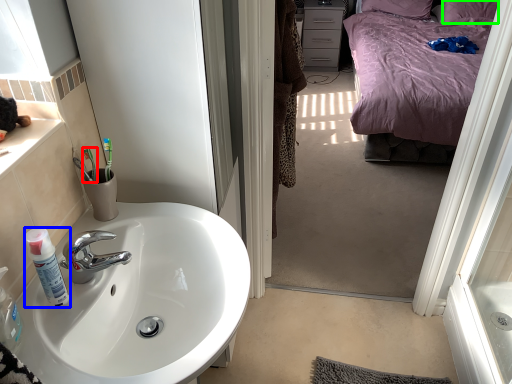
Question: Estimate the real-world distances between objects in this image. Which object is farther from toothbrush (highlighted by a red box), bottle (highlighted by a blue box) or pillow (highlighted by a green box)?

Choices:
 (A) bottle
 (B) pillow

Answer: (B)